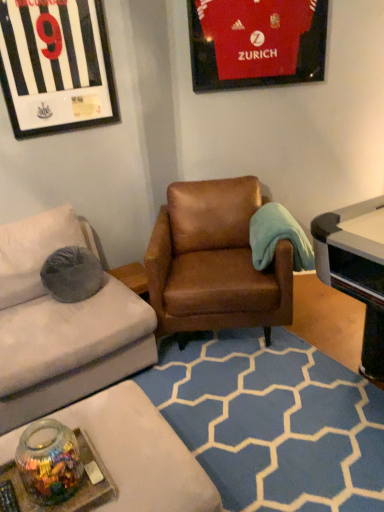
Question: Can you confirm if black plastic remote control at lower left is thinner than brown leather armchair at center?

Choices:
 (A) no
 (B) yes

Answer: (B)

Question: From a real-world perspective, does black plastic remote control at lower left stand above brown leather armchair at center?

Choices:
 (A) yes
 (B) no

Answer: (B)

Question: From the image's perspective, is black plastic remote control at lower left below brown leather armchair at center?

Choices:
 (A) yes
 (B) no

Answer: (A)

Question: Is black plastic remote control at lower left beside brown leather armchair at center?

Choices:
 (A) yes
 (B) no

Answer: (B)

Question: Is black plastic remote control at lower left wider than brown leather armchair at center?

Choices:
 (A) no
 (B) yes

Answer: (A)

Question: Is transparent glass jar at lower left bigger or smaller than black glossy jersey at upper left, which ranks as the first picture frame in left-to-right order?

Choices:
 (A) small
 (B) big

Answer: (A)

Question: From the image's perspective, is transparent glass jar at lower left above or below black glossy jersey at upper left, which is the second picture frame in right-to-left order?

Choices:
 (A) below
 (B) above

Answer: (A)

Question: From a real-world perspective, relative to black glossy jersey at upper left, which ranks as the first picture frame in left-to-right order, is transparent glass jar at lower left vertically above or below?

Choices:
 (A) below
 (B) above

Answer: (A)

Question: Is transparent glass jar at lower left inside or outside of black glossy jersey at upper left, which is the second picture frame in right-to-left order?

Choices:
 (A) inside
 (B) outside

Answer: (B)

Question: Is point (170, 260) closer or farther from the camera than point (13, 461)?

Choices:
 (A) farther
 (B) closer

Answer: (A)

Question: From the image's perspective, is brown leather armchair at center located above or below transparent glass jar at lower left?

Choices:
 (A) above
 (B) below

Answer: (A)

Question: Which is correct: brown leather armchair at center is inside transparent glass jar at lower left, or outside of it?

Choices:
 (A) outside
 (B) inside

Answer: (A)

Question: Is brown leather armchair at center wider or thinner than transparent glass jar at lower left?

Choices:
 (A) wide
 (B) thin

Answer: (A)

Question: Is matte red jersey at upper right, arranged as the 1th picture frame when viewed from the right, to the left or to the right of brown leather armchair at center in the image?

Choices:
 (A) right
 (B) left

Answer: (A)

Question: Based on their sizes in the image, would you say matte red jersey at upper right, arranged as the 1th picture frame when viewed from the right, is bigger or smaller than brown leather armchair at center?

Choices:
 (A) small
 (B) big

Answer: (A)